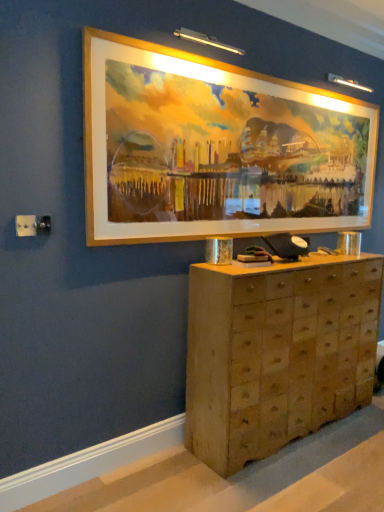
Question: Is gold-framed painting at upper center turned away from wooden chest of drawers at center?

Choices:
 (A) yes
 (B) no

Answer: (B)

Question: Is there a large distance between gold-framed painting at upper center and wooden chest of drawers at center?

Choices:
 (A) no
 (B) yes

Answer: (A)

Question: Is gold-framed painting at upper center positioned beyond the bounds of wooden chest of drawers at center?

Choices:
 (A) no
 (B) yes

Answer: (B)

Question: From a real-world perspective, is gold-framed painting at upper center positioned over wooden chest of drawers at center based on gravity?

Choices:
 (A) yes
 (B) no

Answer: (A)

Question: Can you confirm if gold-framed painting at upper center is thinner than wooden chest of drawers at center?

Choices:
 (A) yes
 (B) no

Answer: (A)

Question: Is wooden chest of drawers at center located within gold-framed painting at upper center?

Choices:
 (A) yes
 (B) no

Answer: (B)

Question: Can you confirm if wooden chest of drawers at center is shorter than gold-framed painting at upper center?

Choices:
 (A) no
 (B) yes

Answer: (A)

Question: From the image's perspective, does wooden chest of drawers at center appear lower than gold-framed painting at upper center?

Choices:
 (A) yes
 (B) no

Answer: (A)

Question: Is wooden chest of drawers at center bigger than gold-framed painting at upper center?

Choices:
 (A) yes
 (B) no

Answer: (A)

Question: From a real-world perspective, is wooden chest of drawers at center on gold-framed painting at upper center?

Choices:
 (A) yes
 (B) no

Answer: (B)

Question: Considering the relative sizes of wooden chest of drawers at center and gold-framed painting at upper center in the image provided, is wooden chest of drawers at center wider than gold-framed painting at upper center?

Choices:
 (A) yes
 (B) no

Answer: (A)

Question: Is wooden chest of drawers at center not close to gold-framed painting at upper center?

Choices:
 (A) no
 (B) yes

Answer: (A)

Question: Does point (317, 267) appear closer or farther from the camera than point (216, 92)?

Choices:
 (A) closer
 (B) farther

Answer: (B)